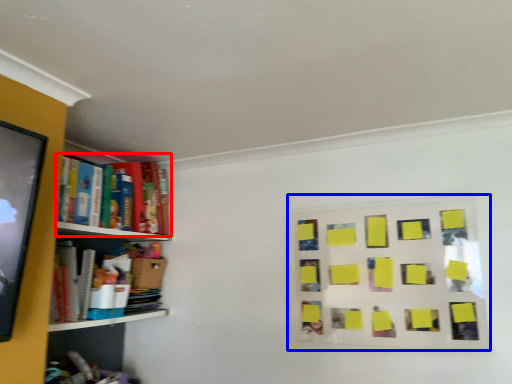
Question: Which object appears closest to the camera in this image, book (highlighted by a red box) or bulletin board (highlighted by a blue box)?

Choices:
 (A) book
 (B) bulletin board

Answer: (B)